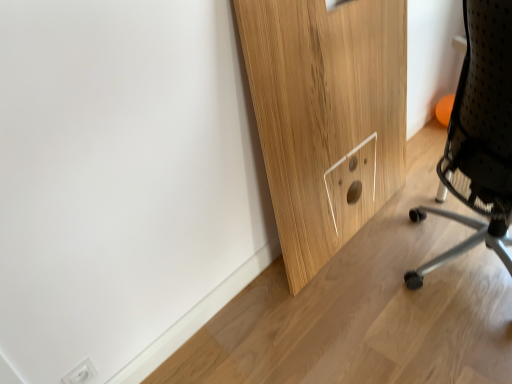
Question: Is point (82, 370) closer or farther from the camera than point (495, 248)?

Choices:
 (A) closer
 (B) farther

Answer: (A)

Question: From their relative heights in the image, would you say white plastic electric outlet at lower left is taller or shorter than black mesh chair at right?

Choices:
 (A) short
 (B) tall

Answer: (A)

Question: Is white plastic electric outlet at lower left inside the boundaries of black mesh chair at right, or outside?

Choices:
 (A) outside
 (B) inside

Answer: (A)

Question: From a real-world perspective, is black mesh chair at right physically located above or below white plastic electric outlet at lower left?

Choices:
 (A) above
 (B) below

Answer: (A)

Question: From the image's perspective, relative to white plastic electric outlet at lower left, is black mesh chair at right above or below?

Choices:
 (A) below
 (B) above

Answer: (B)

Question: Looking at their shapes, would you say black mesh chair at right is wider or thinner than white plastic electric outlet at lower left?

Choices:
 (A) thin
 (B) wide

Answer: (B)

Question: Is black mesh chair at right spatially inside white plastic electric outlet at lower left, or outside of it?

Choices:
 (A) outside
 (B) inside

Answer: (A)